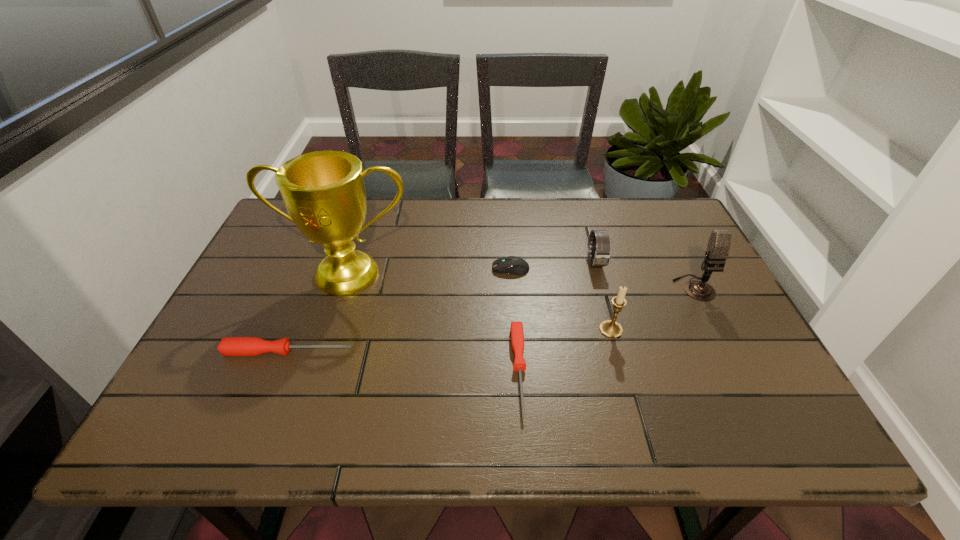
At what (x,y) coordinates should I click in order to perform the action: click on object at the right edge. Please return your answer as a coordinate pair (x, y). Looking at the image, I should click on (719, 242).

In the image, there is a desktop. In order to click on free space at the far edge in this screenshot , I will do `click(542, 203)`.

Locate an element on the screen. Image resolution: width=960 pixels, height=540 pixels. vacant space at the near edge is located at coordinates (491, 400).

Locate an element on the screen. This screenshot has width=960, height=540. blank space at the left edge is located at coordinates (275, 287).

Where is `free spot at the right edge of the desktop`? free spot at the right edge of the desktop is located at coordinates (666, 294).

I want to click on free space at the far right corner, so click(x=645, y=232).

Identify the location of empty space that is in between the microphone and the tallest object. pyautogui.click(x=521, y=281).

At what (x,y) coordinates should I click in order to perform the action: click on free area in between the right screwdriver and the computer equipment. Please return your answer as a coordinate pair (x, y). Image resolution: width=960 pixels, height=540 pixels. Looking at the image, I should click on (515, 320).

Identify the location of free space between the watch and the taller screwdriver. The width and height of the screenshot is (960, 540). (442, 307).

The image size is (960, 540). I want to click on free spot between the shortest object and the computer equipment, so click(515, 320).